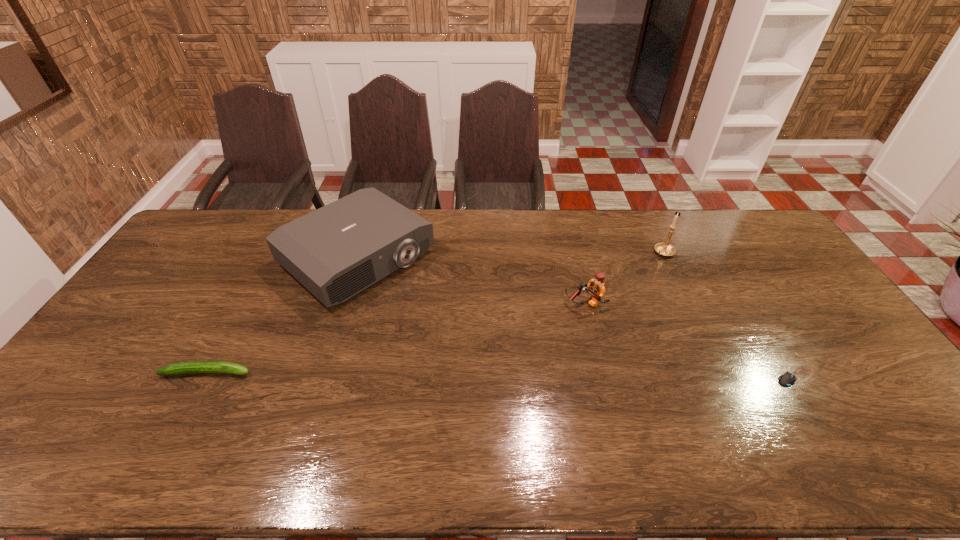
At what (x,y) coordinates should I click in order to perform the action: click on free space on the desktop that is between the zucchini and the rightmost object and is positioned on the handle side of the tallest object. Please return your answer as a coordinate pair (x, y). Looking at the image, I should click on (542, 375).

Where is `vacant spot on the desktop that is between the zucchini and the rightmost object and is positioned on the front-facing side of the projector`? The height and width of the screenshot is (540, 960). vacant spot on the desktop that is between the zucchini and the rightmost object and is positioned on the front-facing side of the projector is located at coordinates (508, 375).

Identify the location of vacant spot on the desktop that is between the zucchini and the rightmost object and is positioned holding a crossbow in the hands of the third object from left to right. The image size is (960, 540). (468, 374).